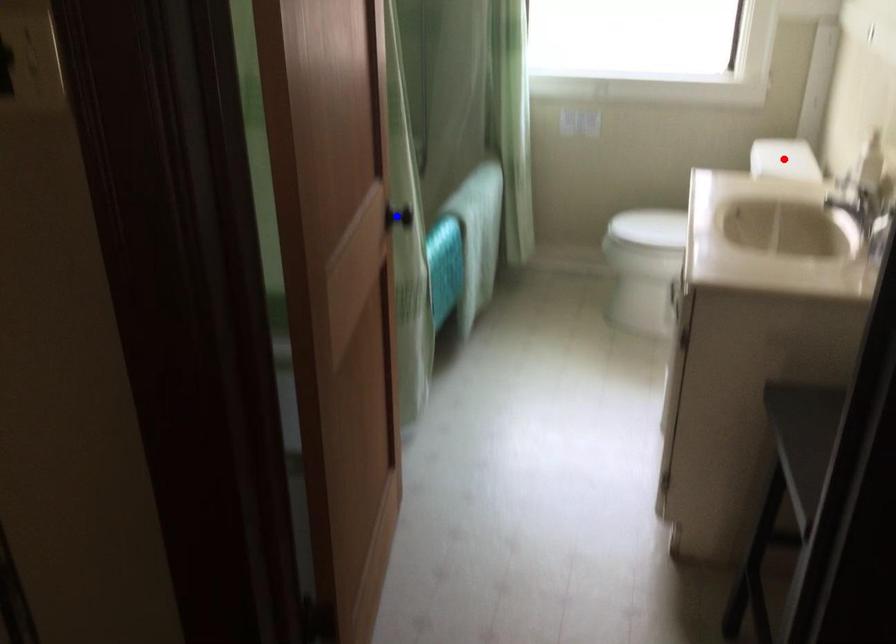
Question: Which of the two points in the image is closer to the camera?

Choices:
 (A) Blue point is closer.
 (B) Red point is closer.

Answer: (A)